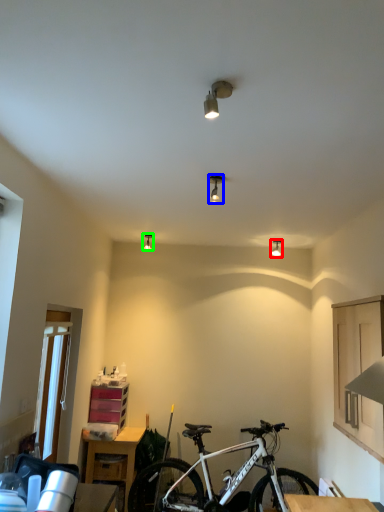
Question: Based on their relative distances, which object is nearer to light fixture (highlighted by a red box)? Choose from light fixture (highlighted by a blue box) and light fixture (highlighted by a green box).

Choices:
 (A) light fixture
 (B) light fixture

Answer: (B)